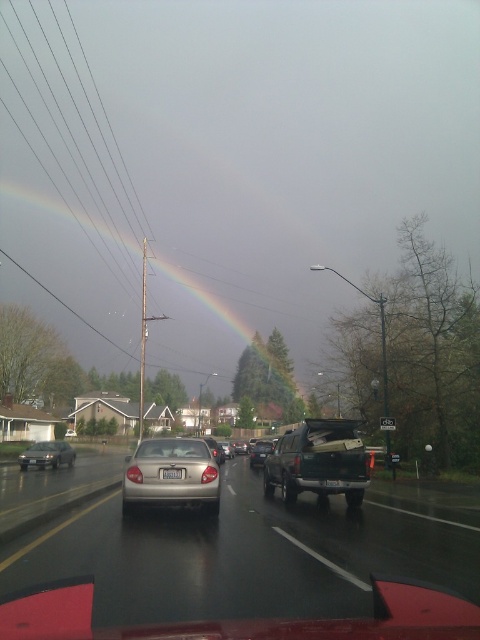
Which is above, black plastic license plate at center or shiny silver sedan at center?

black plastic license plate at center

Which is in front, point (176, 477) or point (245, 442)?

Point (176, 477) is more forward.

Identify the location of black plastic license plate at center. This screenshot has height=640, width=480. (171, 474).

Does point (263, 490) come closer to viewer compared to point (207, 440)?

Yes, point (263, 490) is in front of point (207, 440).

Does point (275, 465) come closer to viewer compared to point (211, 440)?

Yes.

Locate an element on the screen. green matte truck at center is located at coordinates (319, 461).

Does gold matte sedan at center have a lesser width compared to satin silver sedan at center?

Yes.

Consider the image. Is gold matte sedan at center taller than satin silver sedan at center?

In fact, gold matte sedan at center may be shorter than satin silver sedan at center.

What do you see at coordinates (170, 480) in the screenshot? I see `gold matte sedan at center` at bounding box center [170, 480].

The height and width of the screenshot is (640, 480). What are the coordinates of `gold matte sedan at center` in the screenshot? It's located at (170, 480).